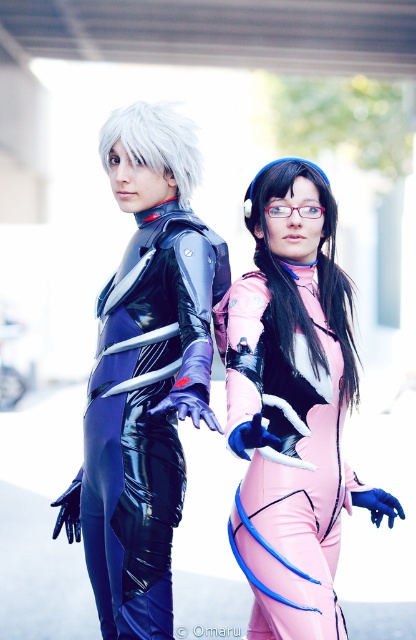
You are a photographer standing at the camera position. You need to adjust your focus to capture the pink matte bodysuit at center clearly. What is the minimum distance you should set your focus to ensure the bodysuit is sharp?

The pink matte bodysuit at center is 12.80 feet from the camera, so you should set the focus distance to at least 12.80 feet to ensure it is sharp.

In the scene shown: You are standing in front of the two cosplayers. The shiny black bodysuit at center is located at point (x=232, y=378). If you want to take a photo of the shiny black bodysuit at center, which direction should you move to get it centered in your camera view?

The shiny black bodysuit at center is already located at point (x=232, y=378), so you should move towards that point to center it in your camera view.